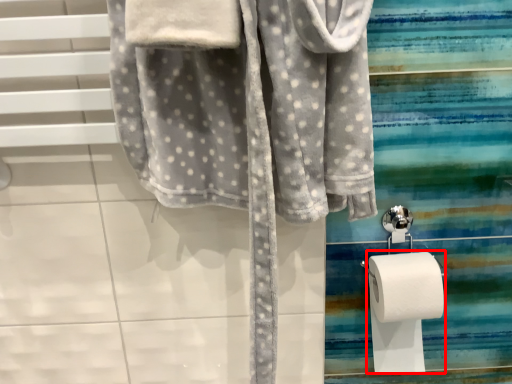
Question: From the image's perspective, considering the relative positions of toilet paper (annotated by the red box) and towel in the image provided, where is toilet paper (annotated by the red box) located with respect to the staircase?

Choices:
 (A) above
 (B) below

Answer: (B)